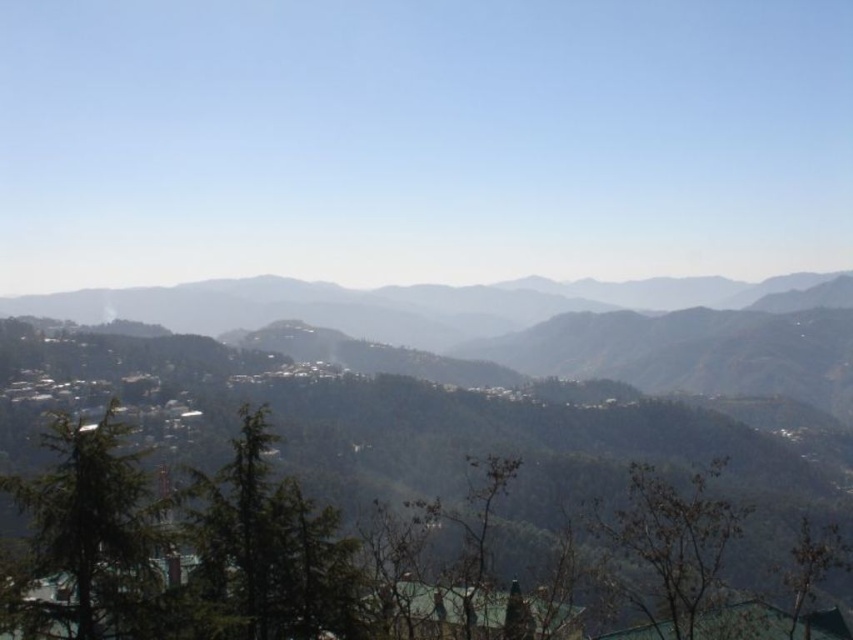
You are standing at the point labeled point [300,461] in the image. The distance between you and the viewer is 634.77 feet. If you want to walk towards the nearest mountain peak, which direction should you head?

The point labeled point [300,461] is 634.77 feet away from the viewer. To reach the nearest mountain peak, you should head towards the background, where the mountains are located in the image.